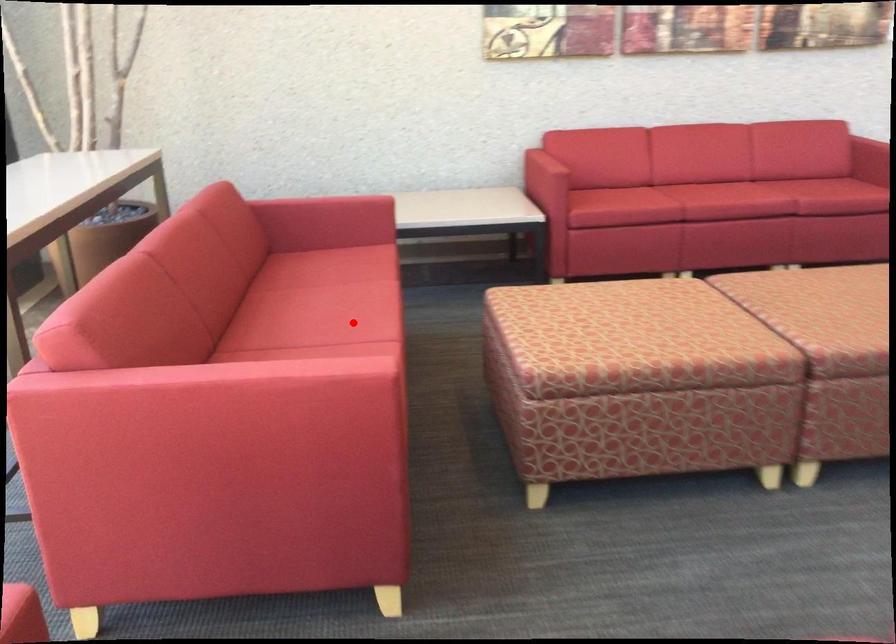
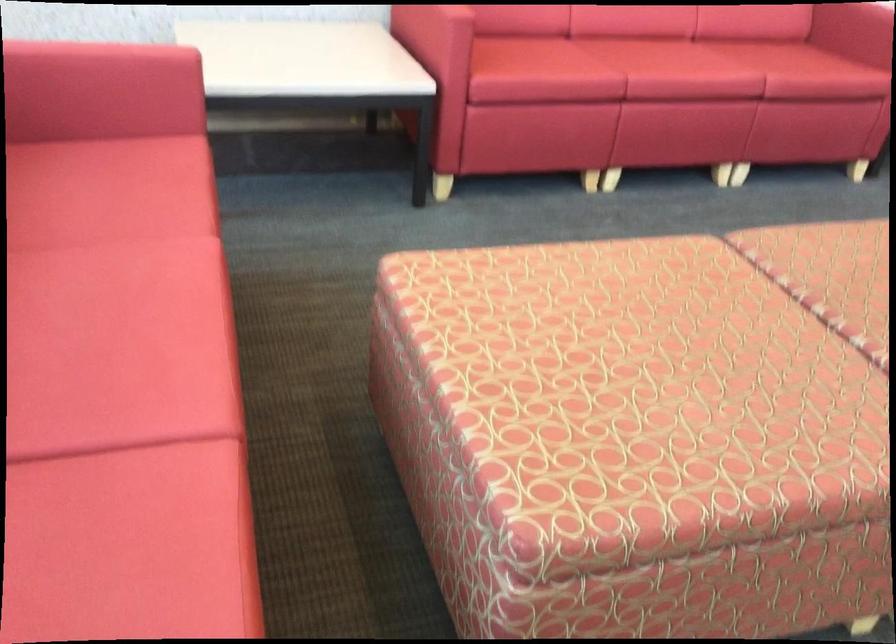
Question: I am providing you with two images of the same scene from different viewpoints. Image1 has a red point marked. In image2, the corresponding 3D location appears at what relative position? Reply with the corresponding letter.

Choices:
 (A) Closer
 (B) Farther

Answer: (A)